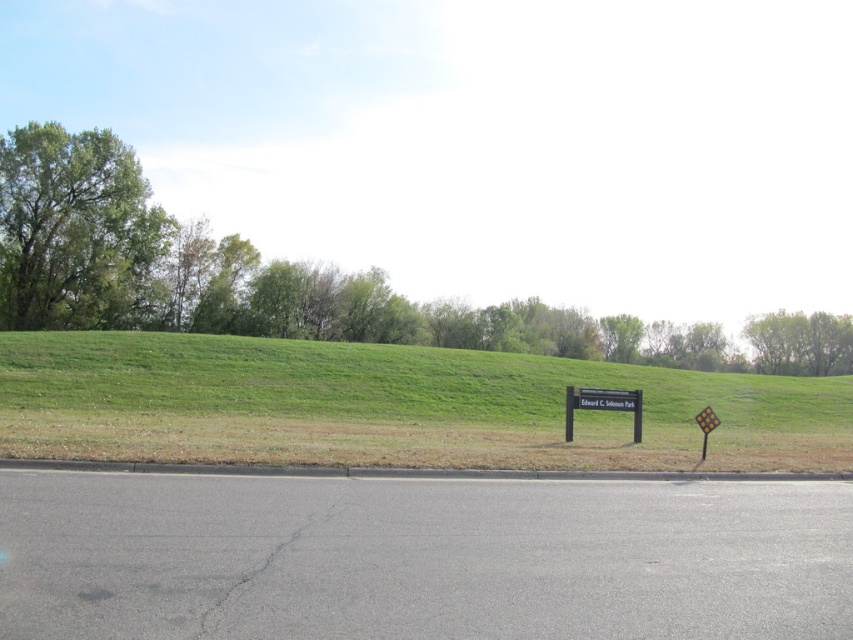
You are standing at the edge of the paved road and want to climb the green grassy hillside at center. Which direction should you face to start your climb?

The green grassy hillside at center is located at coordinates point (392, 406), so you should face towards the center of the image to start climbing the green grassy hillside at center.

You are a hiker standing on the paved road and looking towards the green grassy hillside at center and the black plastic sign at center. Which object is higher up in the scene?

The black plastic sign at center is higher up in the scene because the green grassy hillside at center is below it.